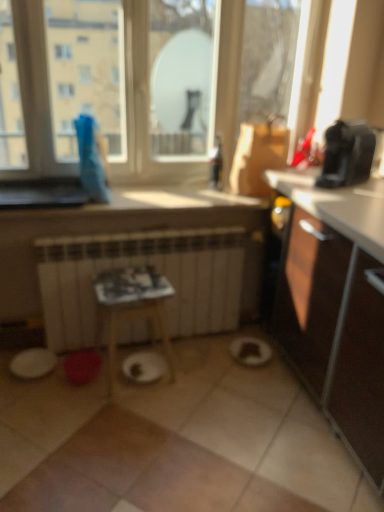
Question: From the image's perspective, is white matte radiator at center beneath white matte paper plate at center?

Choices:
 (A) no
 (B) yes

Answer: (A)

Question: Considering the relative sizes of white matte radiator at center and white matte paper plate at center in the image provided, is white matte radiator at center bigger than white matte paper plate at center?

Choices:
 (A) yes
 (B) no

Answer: (A)

Question: Does white matte radiator at center have a greater width compared to white matte paper plate at center?

Choices:
 (A) no
 (B) yes

Answer: (A)

Question: From a real-world perspective, is white matte radiator at center on white matte paper plate at center?

Choices:
 (A) yes
 (B) no

Answer: (A)

Question: Are white matte radiator at center and white matte paper plate at center making contact?

Choices:
 (A) no
 (B) yes

Answer: (A)

Question: From a real-world perspective, is white matte radiator at center physically below white matte paper plate at center?

Choices:
 (A) no
 (B) yes

Answer: (A)

Question: Is transparent glass window at upper center positioned before white matte radiator at center?

Choices:
 (A) no
 (B) yes

Answer: (B)

Question: Can you confirm if transparent glass window at upper center is positioned to the left of white matte radiator at center?

Choices:
 (A) no
 (B) yes

Answer: (A)

Question: Does transparent glass window at upper center come behind white matte radiator at center?

Choices:
 (A) no
 (B) yes

Answer: (A)

Question: Can you confirm if transparent glass window at upper center is wider than white matte radiator at center?

Choices:
 (A) no
 (B) yes

Answer: (A)

Question: From the image's perspective, would you say transparent glass window at upper center is positioned over white matte radiator at center?

Choices:
 (A) yes
 (B) no

Answer: (A)

Question: Considering the relative sizes of transparent glass window at upper center and white matte radiator at center in the image provided, is transparent glass window at upper center smaller than white matte radiator at center?

Choices:
 (A) yes
 (B) no

Answer: (B)

Question: Is transparent glass window at upper center smaller than white matte paper plate at center?

Choices:
 (A) yes
 (B) no

Answer: (B)